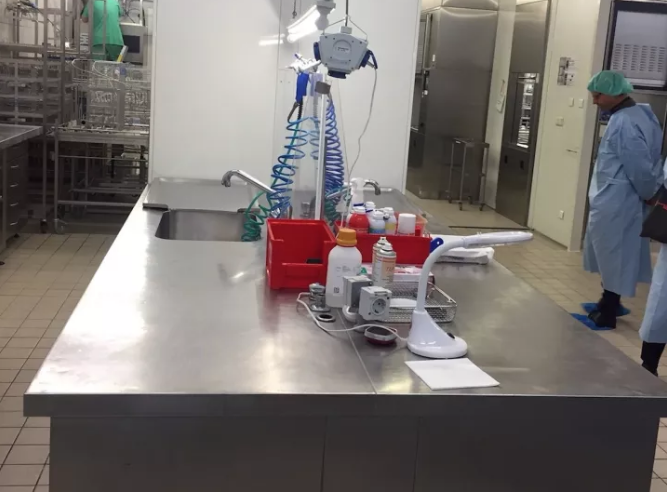
I want to click on metal countertop, so click(189, 363).